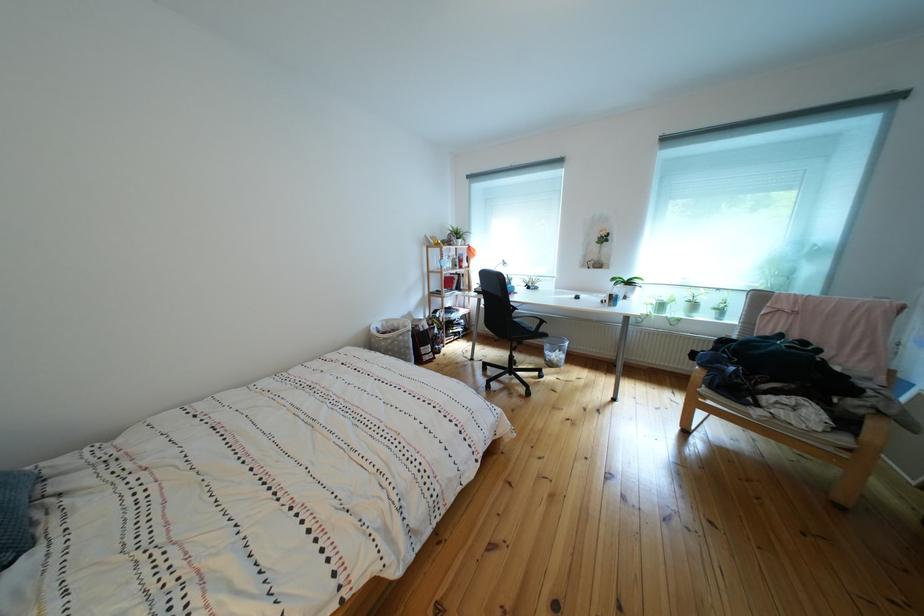
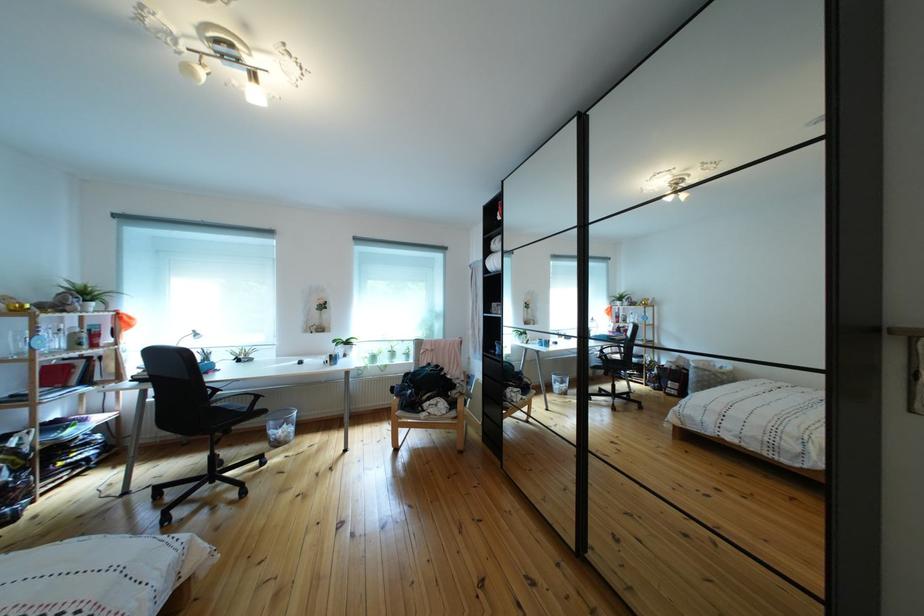
Locate, in the second image, the point that corresponds to pixel 520 307 in the first image.

(214, 389)